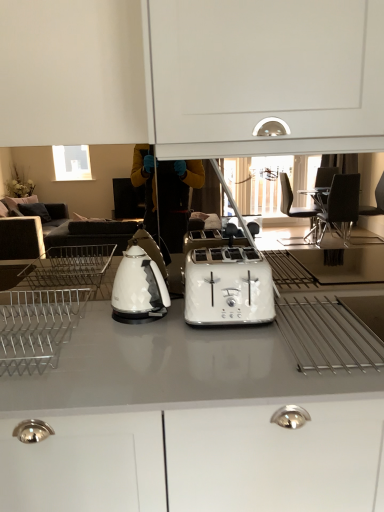
Question: Can you see white glossy toaster at center touching metallic silver dish rack at left?

Choices:
 (A) yes
 (B) no

Answer: (B)

Question: Is white glossy toaster at center facing away from metallic silver dish rack at left?

Choices:
 (A) yes
 (B) no

Answer: (B)

Question: Is white glossy toaster at center positioned beyond the bounds of metallic silver dish rack at left?

Choices:
 (A) no
 (B) yes

Answer: (B)

Question: Is white glossy toaster at center oriented towards metallic silver dish rack at left?

Choices:
 (A) yes
 (B) no

Answer: (B)

Question: From a real-world perspective, does white glossy toaster at center stand above metallic silver dish rack at left?

Choices:
 (A) yes
 (B) no

Answer: (A)

Question: From the image's perspective, is white glossy electric kettle at left positioned above or below white glossy countertop at center?

Choices:
 (A) below
 (B) above

Answer: (B)

Question: Is point (132, 254) closer or farther from the camera than point (382, 493)?

Choices:
 (A) closer
 (B) farther

Answer: (B)

Question: Considering their positions, is white glossy electric kettle at left located in front of or behind white glossy countertop at center?

Choices:
 (A) front
 (B) behind

Answer: (B)

Question: From their relative heights in the image, would you say white glossy electric kettle at left is taller or shorter than white glossy countertop at center?

Choices:
 (A) tall
 (B) short

Answer: (B)

Question: Would you say white glossy toaster at center is to the left or to the right of white glossy electric kettle at left in the picture?

Choices:
 (A) right
 (B) left

Answer: (A)

Question: From a real-world perspective, is white glossy toaster at center above or below white glossy electric kettle at left?

Choices:
 (A) below
 (B) above

Answer: (A)

Question: Considering the positions of white glossy toaster at center and white glossy electric kettle at left in the image, is white glossy toaster at center wider or thinner than white glossy electric kettle at left?

Choices:
 (A) thin
 (B) wide

Answer: (B)

Question: From the image's perspective, is white glossy toaster at center above or below white glossy electric kettle at left?

Choices:
 (A) above
 (B) below

Answer: (B)

Question: Looking at their shapes, would you say white glossy toaster at center is wider or thinner than white glossy countertop at center?

Choices:
 (A) thin
 (B) wide

Answer: (A)

Question: In terms of height, does white glossy toaster at center look taller or shorter compared to white glossy countertop at center?

Choices:
 (A) short
 (B) tall

Answer: (A)